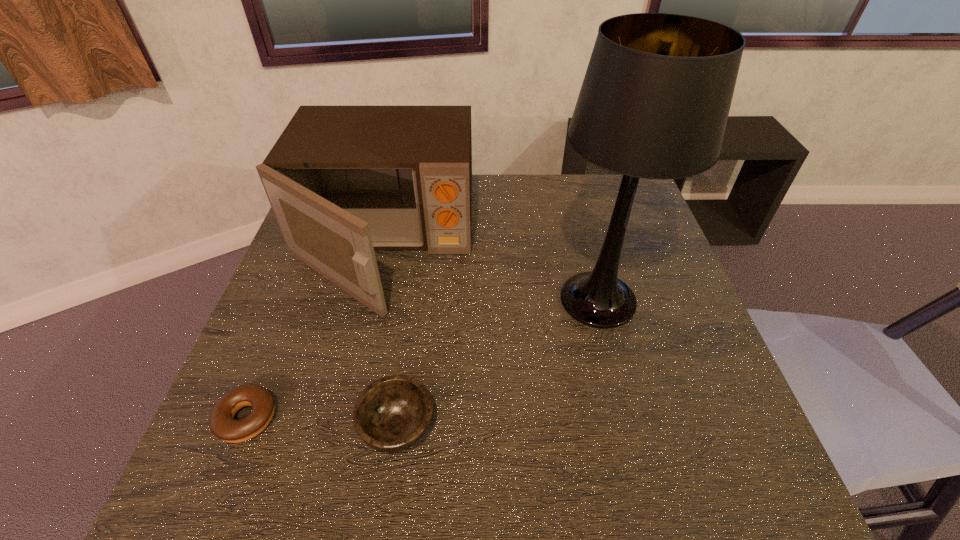
You are a GUI agent. You are given a task and a screenshot of the screen. Output one action in this format:
    pyautogui.click(x=<x>, y=<y>)
    Task: Click on the object at the near edge
    
    Given the screenshot: What is the action you would take?
    pyautogui.click(x=393, y=413)

Locate an element on the screen. microwave oven located at the left edge is located at coordinates (343, 181).

The image size is (960, 540). Identify the location of doughnut located in the left edge section of the desktop. (222, 424).

The width and height of the screenshot is (960, 540). I want to click on object that is at the right edge, so click(x=654, y=103).

Identify the location of object at the far left corner. (343, 181).

This screenshot has height=540, width=960. I want to click on free space at the far edge of the desktop, so click(x=540, y=178).

The image size is (960, 540). In order to click on blank space at the near edge of the desktop in this screenshot , I will do `click(560, 459)`.

Locate an element on the screen. The image size is (960, 540). vacant area at the left edge of the desktop is located at coordinates (277, 333).

The width and height of the screenshot is (960, 540). What are the coordinates of `vacant space at the right edge of the desktop` in the screenshot? It's located at (635, 262).

Image resolution: width=960 pixels, height=540 pixels. Identify the location of free space that is in between the shortest object and the table lamp. (422, 359).